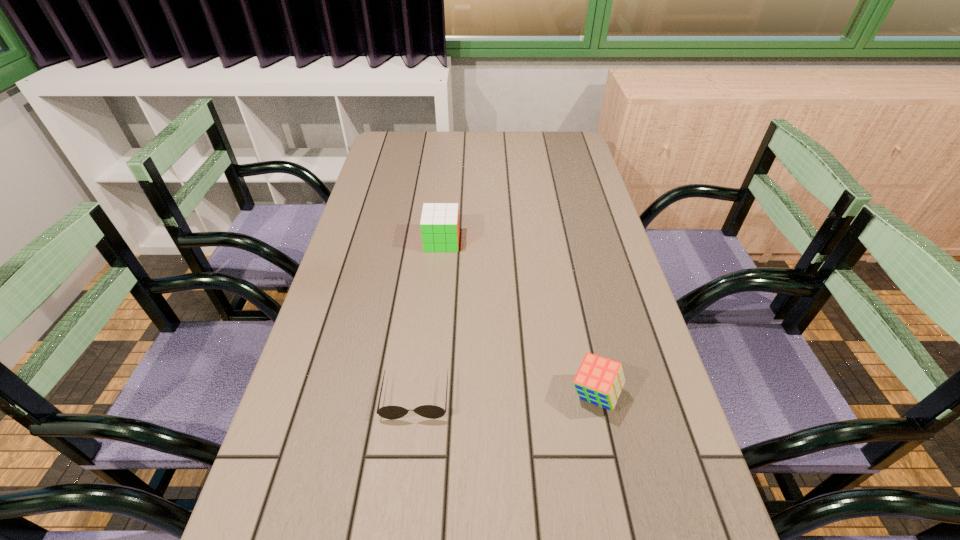
At what (x,y) coordinates should I click in order to perform the action: click on the right cube. Please return your answer as a coordinate pair (x, y). Looking at the image, I should click on (599, 380).

Where is `the rightmost object`? The image size is (960, 540). the rightmost object is located at coordinates (599, 380).

Where is `the farther cube`? Image resolution: width=960 pixels, height=540 pixels. the farther cube is located at coordinates (439, 224).

I want to click on the farthest object, so click(x=439, y=224).

The width and height of the screenshot is (960, 540). In order to click on sunglasses in this screenshot , I will do `click(428, 411)`.

This screenshot has height=540, width=960. I want to click on vacant space located 0.380m on the back of the nearer cube, so click(x=566, y=259).

Identify the location of free space located 0.170m on the left of the farthest object. This screenshot has height=540, width=960. (367, 241).

I want to click on vacant region located 0.170m on the front-facing side of the shortest object, so click(x=402, y=511).

Find the location of `object located at the right edge`. object located at the right edge is located at coordinates (599, 380).

Locate an element on the screen. This screenshot has width=960, height=540. free space at the far edge of the desktop is located at coordinates (450, 144).